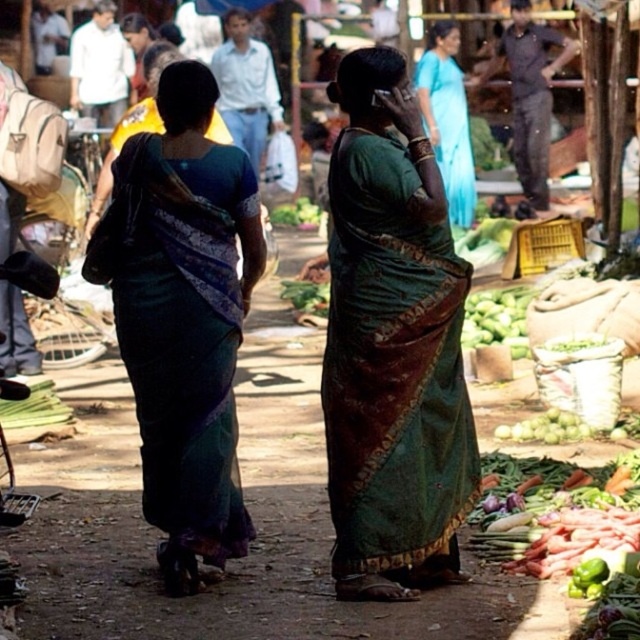
Can you confirm if blue silk saree at center is taller than green matte cucumber at center?

Correct, blue silk saree at center is much taller as green matte cucumber at center.

Does blue silk saree at center appear under green matte cucumber at center?

Actually, blue silk saree at center is above green matte cucumber at center.

Between point (464, 108) and point (528, 288), which one is positioned behind?

Positioned behind is point (464, 108).

The height and width of the screenshot is (640, 640). I want to click on blue silk saree at center, so click(448, 118).

Consider the image. Does green silk saree at center have a greater width compared to blue silk saree at center?

Yes.

Is point (438, 205) closer to viewer compared to point (452, 156)?

Yes, it is in front of point (452, 156).

The width and height of the screenshot is (640, 640). I want to click on green silk saree at center, so click(x=392, y=346).

Who is shorter, dark green silk saree at center or green leafy vegetable at center?

Standing shorter between the two is green leafy vegetable at center.

Locate an element on the screen. This screenshot has width=640, height=640. dark green silk saree at center is located at coordinates (182, 317).